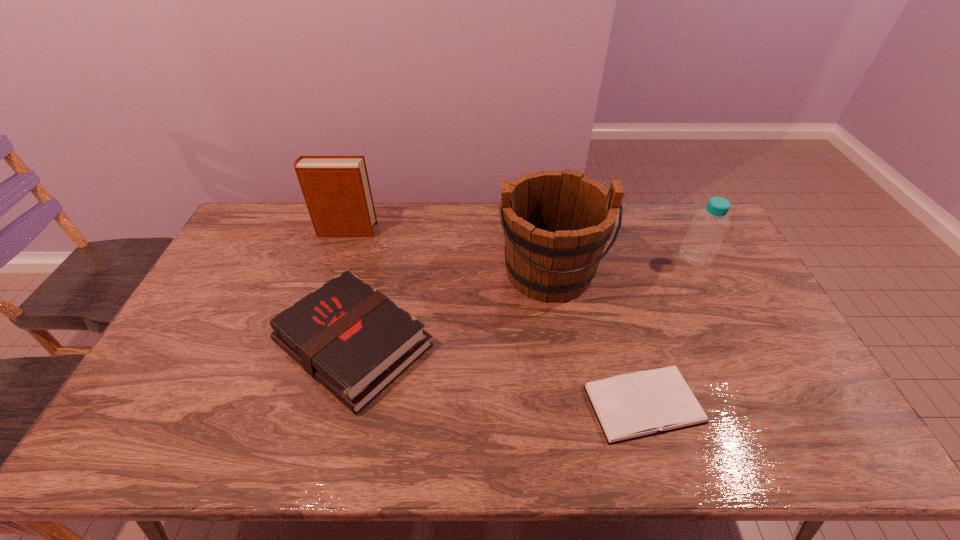
The height and width of the screenshot is (540, 960). In order to click on the tallest object in this screenshot , I will do `click(556, 224)`.

Locate an element on the screen. the farthest object is located at coordinates (336, 188).

Where is `the farthest hardback book`? the farthest hardback book is located at coordinates (336, 188).

Where is `the third shortest object`? the third shortest object is located at coordinates (701, 244).

Where is `the rightmost object`? the rightmost object is located at coordinates (701, 244).

Locate an element on the screen. the second tallest hardback book is located at coordinates (352, 339).

You are a GUI agent. You are given a task and a screenshot of the screen. Output one action in this format:
    pyautogui.click(x=<x>, y=<y>)
    Task: Click on the rightmost hardback book
    The width and height of the screenshot is (960, 540).
    Given the screenshot: What is the action you would take?
    pyautogui.click(x=630, y=406)

Find the location of `the shortest hardback book`. the shortest hardback book is located at coordinates (630, 406).

The width and height of the screenshot is (960, 540). I want to click on free spot located on the side of the tallest object with the handle for carrying, so click(563, 353).

At what (x,y) coordinates should I click in order to perform the action: click on vacant area located on the open cover of the farthest object. Please return your answer as a coordinate pair (x, y). Looking at the image, I should click on (468, 230).